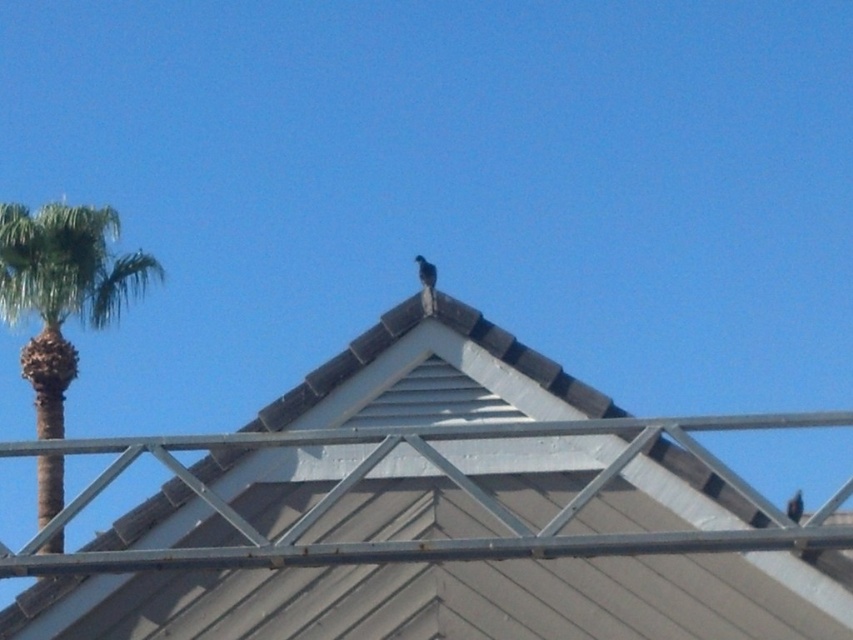
Which is above, green leafy palm tree at left or dark brown feathered bird at upper center?

Positioned higher is green leafy palm tree at left.

Does green leafy palm tree at left appear on the right side of dark brown feathered bird at upper center?

Incorrect, green leafy palm tree at left is not on the right side of dark brown feathered bird at upper center.

Does point (6, 225) lie in front of point (798, 515)?

No, (6, 225) is further to viewer.

Identify the location of green leafy palm tree at left. The height and width of the screenshot is (640, 853). (62, 289).

Is brown shingles at center bigger than shiny blue bird at upper center?

Indeed, brown shingles at center has a larger size compared to shiny blue bird at upper center.

Is brown shingles at center below shiny blue bird at upper center?

Indeed, brown shingles at center is positioned under shiny blue bird at upper center.

Consider the image. Who is more distant from viewer, [236,545] or [431,266]?

Point [431,266]

Find the location of a particular element. The image size is (853, 640). brown shingles at center is located at coordinates (440, 516).

Identify the location of shiny blue bird at upper center. (425, 273).

The width and height of the screenshot is (853, 640). Find the location of `shiny blue bird at upper center`. shiny blue bird at upper center is located at coordinates (425, 273).